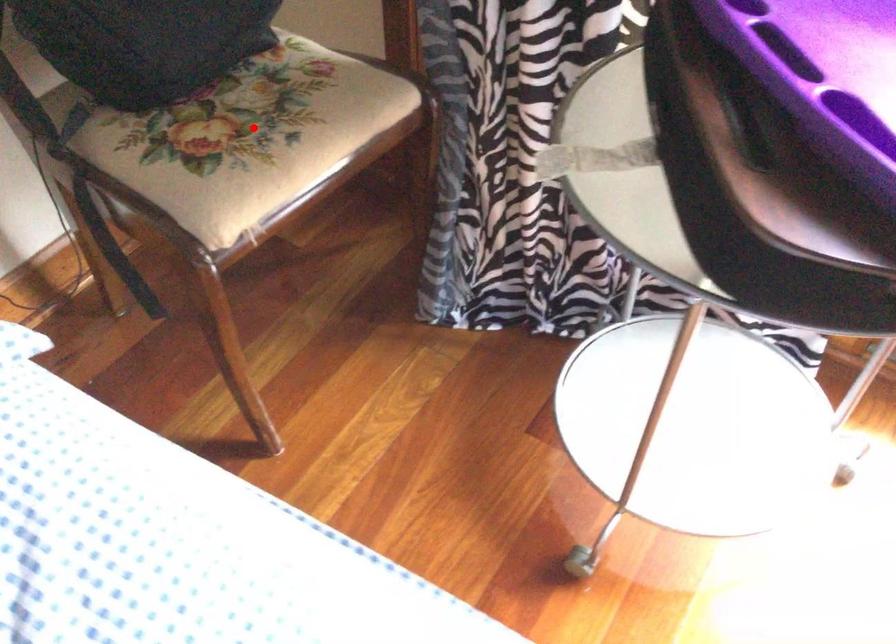
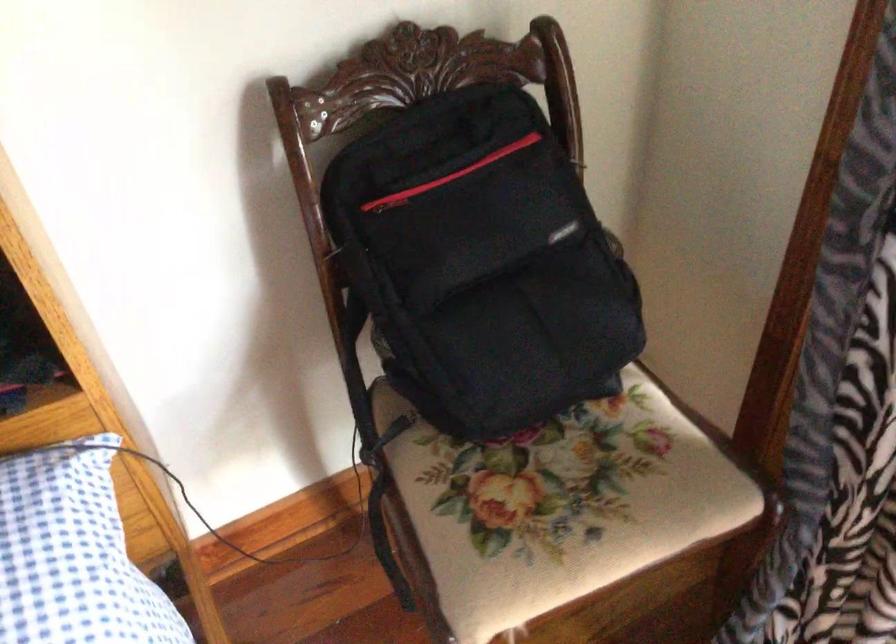
Question: A red point is marked in image1. In image2, is the corresponding 3D point closer to the camera or farther? Reply with the corresponding letter.

Choices:
 (A) The corresponding 3D point is closer.
 (B) The corresponding 3D point is farther.

Answer: (A)